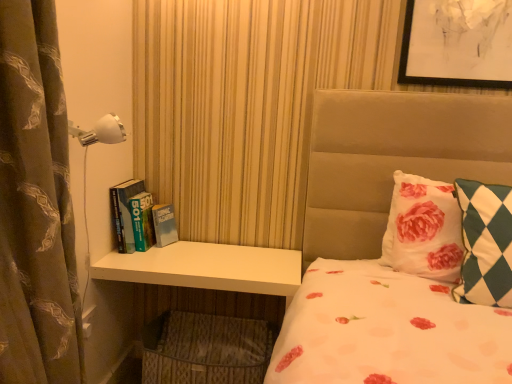
The image size is (512, 384). Describe the element at coordinates (423, 229) in the screenshot. I see `white floral pillow at upper right, marked as the first pillow in a back-to-front arrangement` at that location.

Identify the location of green checkered pillow at right, marked as the second pillow in a back-to-front arrangement. This screenshot has height=384, width=512. click(485, 244).

Measure the distance between green matte book at left and camera.

green matte book at left is 5.87 feet from camera.

This screenshot has width=512, height=384. What do you see at coordinates (100, 131) in the screenshot?
I see `white plastic lamp at upper left` at bounding box center [100, 131].

What do you see at coordinates (35, 204) in the screenshot?
I see `brown printed fabric curtain at left` at bounding box center [35, 204].

Find the location of a particular element. This screenshot has width=512, height=384. white matte dresser at lower left is located at coordinates (207, 268).

The width and height of the screenshot is (512, 384). What are the coordinates of `white floral pillow at upper right, marked as the first pillow in a back-to-front arrangement` in the screenshot? It's located at [423, 229].

Does white matte dresser at lower left have a lesser width compared to green matte book at left?

No.

Is green matte book at left at the back of white matte dresser at lower left?

white matte dresser at lower left does not have its back to green matte book at left.

You are a GUI agent. You are given a task and a screenshot of the screen. Output one action in this format:
    pyautogui.click(x=<x>, y=<y>)
    Task: Click on the dresser that appears on the right of green matte book at left
    The width and height of the screenshot is (512, 384).
    Given the screenshot: What is the action you would take?
    pyautogui.click(x=207, y=268)

Is white matte dresser at lower left to the left or to the right of green matte book at left in the image?

white matte dresser at lower left is to the right of green matte book at left.

Is green matte book at left smaller than green checkered pillow at right, marked as the second pillow in a back-to-front arrangement?

Yes, green matte book at left is smaller than green checkered pillow at right, marked as the second pillow in a back-to-front arrangement.

Is green matte book at left facing away from green checkered pillow at right, marked as the second pillow in a back-to-front arrangement?

No, green matte book at left is not facing the opposite direction of green checkered pillow at right, marked as the second pillow in a back-to-front arrangement.

Is green matte book at left to the left of green checkered pillow at right, the first pillow in the front-to-back sequence, from the viewer's perspective?

Indeed, green matte book at left is positioned on the left side of green checkered pillow at right, the first pillow in the front-to-back sequence.

Which object is more forward, green matte book at left or white matte dresser at lower left?

Positioned in front is white matte dresser at lower left.

At what (x,y) coordinates should I click in order to perform the action: click on dresser located below the green matte book at left (from the image's perspective). Please return your answer as a coordinate pair (x, y). This screenshot has width=512, height=384. Looking at the image, I should click on (207, 268).

From a real-world perspective, is green matte book at left positioned under white matte dresser at lower left based on gravity?

No.

Between point (150, 243) and point (214, 253), which one is positioned in front?

The point (214, 253) is more forward.

Does brown printed fabric curtain at left have a greater width compared to green checkered pillow at right, marked as the second pillow in a back-to-front arrangement?

Yes.

Between brown printed fabric curtain at left and green checkered pillow at right, the first pillow in the front-to-back sequence, which one is positioned in front?

brown printed fabric curtain at left is in front.

Between brown printed fabric curtain at left and green checkered pillow at right, the first pillow in the front-to-back sequence, which one appears on the left side from the viewer's perspective?

Positioned to the left is brown printed fabric curtain at left.

Can you tell me how much brown printed fabric curtain at left and green checkered pillow at right, the first pillow in the front-to-back sequence, differ in facing direction?

90.9 degrees.

From the image's perspective, is white matte dresser at lower left beneath green checkered pillow at right, marked as the second pillow in a back-to-front arrangement?

Yes, from the image's perspective, white matte dresser at lower left is below green checkered pillow at right, marked as the second pillow in a back-to-front arrangement.

Is white matte dresser at lower left positioned with its back to green checkered pillow at right, marked as the second pillow in a back-to-front arrangement?

No, green checkered pillow at right, marked as the second pillow in a back-to-front arrangement, is not at the back of white matte dresser at lower left.

Which of these two, white matte dresser at lower left or green checkered pillow at right, the first pillow in the front-to-back sequence, is wider?

With larger width is white matte dresser at lower left.

Is white matte dresser at lower left completely or partially outside of green checkered pillow at right, marked as the second pillow in a back-to-front arrangement?

Absolutely, white matte dresser at lower left is external to green checkered pillow at right, marked as the second pillow in a back-to-front arrangement.

Could white matte dresser at lower left be considered to be inside white floral pillow at upper right, marked as the first pillow in a back-to-front arrangement?

Actually, white matte dresser at lower left is outside white floral pillow at upper right, marked as the first pillow in a back-to-front arrangement.

From a real-world perspective, between white floral pillow at upper right, marked as the first pillow in a back-to-front arrangement, and white matte dresser at lower left, who is vertically higher?

white floral pillow at upper right, marked as the first pillow in a back-to-front arrangement, is physically above.

Who is shorter, white floral pillow at upper right, acting as the 2th pillow starting from the front, or white matte dresser at lower left?

Standing shorter between the two is white floral pillow at upper right, acting as the 2th pillow starting from the front.

Which is further, (393,267) or (259,287)?

The point (393,267) is more distant.

Which object is closer to the camera, white floral pillow at upper right, acting as the 2th pillow starting from the front, or brown printed fabric curtain at left?

brown printed fabric curtain at left is in front.

Is white floral pillow at upper right, acting as the 2th pillow starting from the front, to the left of brown printed fabric curtain at left from the viewer's perspective?

No.

Consider the image. Between white floral pillow at upper right, marked as the first pillow in a back-to-front arrangement, and brown printed fabric curtain at left, which one has smaller width?

white floral pillow at upper right, marked as the first pillow in a back-to-front arrangement.

Considering the relative sizes of white floral pillow at upper right, marked as the first pillow in a back-to-front arrangement, and brown printed fabric curtain at left in the image provided, is white floral pillow at upper right, marked as the first pillow in a back-to-front arrangement, shorter than brown printed fabric curtain at left?

Yes.

Identify the location of book to the left of white matte dresser at lower left. This screenshot has height=384, width=512. (140, 218).

You are a GUI agent. You are given a task and a screenshot of the screen. Output one action in this format:
    pyautogui.click(x=<x>, y=<y>)
    Task: Click on the book that appears below the green checkered pillow at right, marked as the second pillow in a back-to-front arrangement (from a real-world perspective)
    
    Given the screenshot: What is the action you would take?
    pyautogui.click(x=140, y=218)

Which object lies further to the anchor point white plastic lamp at upper left, white matte dresser at lower left or brown printed fabric curtain at left?

Based on the image, white matte dresser at lower left appears to be further to white plastic lamp at upper left.

Considering their positions, is white matte dresser at lower left positioned closer to white plastic lamp at upper left than white floral pillow at upper right, marked as the first pillow in a back-to-front arrangement?

white matte dresser at lower left is positioned closer to the anchor white plastic lamp at upper left.

From the image, which object appears to be nearer to white floral pillow at upper right, acting as the 2th pillow starting from the front, green checkered pillow at right, the first pillow in the front-to-back sequence, or green matte book at left?

The object closer to white floral pillow at upper right, acting as the 2th pillow starting from the front, is green checkered pillow at right, the first pillow in the front-to-back sequence.

Considering their positions, is green checkered pillow at right, marked as the second pillow in a back-to-front arrangement, positioned closer to green matte book at left than brown printed fabric curtain at left?

brown printed fabric curtain at left is closer to green matte book at left.

From the image, which object appears to be farther from green checkered pillow at right, marked as the second pillow in a back-to-front arrangement, white matte dresser at lower left or green matte book at left?

Among the two, green matte book at left is located further to green checkered pillow at right, marked as the second pillow in a back-to-front arrangement.

From the image, which object appears to be farther from green checkered pillow at right, the first pillow in the front-to-back sequence, green matte book at left or white plastic lamp at upper left?

green matte book at left is further to green checkered pillow at right, the first pillow in the front-to-back sequence.

Based on their spatial positions, is white matte dresser at lower left or green matte book at left closer to white floral pillow at upper right, marked as the first pillow in a back-to-front arrangement?

white matte dresser at lower left lies closer to white floral pillow at upper right, marked as the first pillow in a back-to-front arrangement, than the other object.

Which object lies nearer to the anchor point white floral pillow at upper right, marked as the first pillow in a back-to-front arrangement, green matte book at left or white matte dresser at lower left?

The object closer to white floral pillow at upper right, marked as the first pillow in a back-to-front arrangement, is white matte dresser at lower left.

Locate an element on the screen. The width and height of the screenshot is (512, 384). lamp located between brown printed fabric curtain at left and white matte dresser at lower left in the depth direction is located at coordinates (100, 131).

Identify the location of dresser between brown printed fabric curtain at left and green checkered pillow at right, marked as the second pillow in a back-to-front arrangement, in the horizontal direction. (207, 268).

Locate an element on the screen. book between white plastic lamp at upper left and white matte dresser at lower left in the vertical direction is located at coordinates (140, 218).

Where is `pillow between brown printed fabric curtain at left and green checkered pillow at right, marked as the second pillow in a back-to-front arrangement, from left to right`? Image resolution: width=512 pixels, height=384 pixels. pillow between brown printed fabric curtain at left and green checkered pillow at right, marked as the second pillow in a back-to-front arrangement, from left to right is located at coordinates (423, 229).